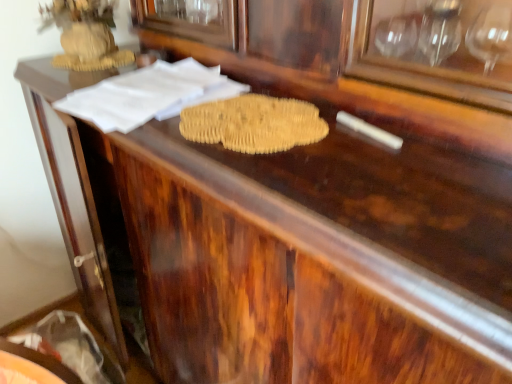
This screenshot has height=384, width=512. Find the location of `vacant space situated above baked golden bread at center (from a real-world perspective)`. vacant space situated above baked golden bread at center (from a real-world perspective) is located at coordinates (254, 105).